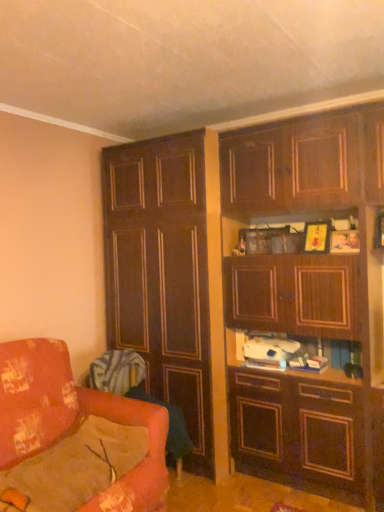
Question: Considering the relative positions of velvet orange swivel chair at lower left, arranged as the 1th swivel chair when viewed from the top, and wooden cabinet at upper right, which ranks as the second cabinetry in left-to-right order, in the image provided, is velvet orange swivel chair at lower left, arranged as the 1th swivel chair when viewed from the top, to the left of wooden cabinet at upper right, which ranks as the second cabinetry in left-to-right order, from the viewer's perspective?

Choices:
 (A) yes
 (B) no

Answer: (A)

Question: From a real-world perspective, does velvet orange swivel chair at lower left, the 2th swivel chair in the bottom-to-top sequence, sit lower than wooden cabinet at upper right, which ranks as the second cabinetry in left-to-right order?

Choices:
 (A) yes
 (B) no

Answer: (A)

Question: From the image's perspective, does velvet orange swivel chair at lower left, the 2th swivel chair in the bottom-to-top sequence, appear higher than wooden cabinet at upper right, arranged as the 1th cabinetry when viewed from the right?

Choices:
 (A) yes
 (B) no

Answer: (B)

Question: Is velvet orange swivel chair at lower left, arranged as the 1th swivel chair when viewed from the top, positioned far away from wooden cabinet at upper right, arranged as the 1th cabinetry when viewed from the right?

Choices:
 (A) no
 (B) yes

Answer: (A)

Question: Is velvet orange swivel chair at lower left, the 2th swivel chair in the bottom-to-top sequence, surrounding wooden cabinet at upper right, which ranks as the second cabinetry in left-to-right order?

Choices:
 (A) yes
 (B) no

Answer: (B)

Question: Is point (56, 501) closer or farther from the camera than point (190, 443)?

Choices:
 (A) closer
 (B) farther

Answer: (A)

Question: From the image's perspective, is floral fabric couch at lower left located above or below velvet orange swivel chair at lower left, the second swivel chair from the top?

Choices:
 (A) above
 (B) below

Answer: (A)

Question: Considering the positions of floral fabric couch at lower left and velvet orange swivel chair at lower left, acting as the 1th swivel chair starting from the bottom, in the image, is floral fabric couch at lower left wider or thinner than velvet orange swivel chair at lower left, acting as the 1th swivel chair starting from the bottom,?

Choices:
 (A) wide
 (B) thin

Answer: (A)

Question: Is floral fabric couch at lower left in front of or behind velvet orange swivel chair at lower left, the second swivel chair from the top, in the image?

Choices:
 (A) front
 (B) behind

Answer: (A)

Question: From a real-world perspective, is velvet orange swivel chair at lower left, acting as the 1th swivel chair starting from the bottom, positioned above or below wooden cabinet at upper right, arranged as the 1th cabinetry when viewed from the right?

Choices:
 (A) above
 (B) below

Answer: (B)

Question: Would you say velvet orange swivel chair at lower left, acting as the 1th swivel chair starting from the bottom, is to the left or to the right of wooden cabinet at upper right, which ranks as the second cabinetry in left-to-right order, in the picture?

Choices:
 (A) left
 (B) right

Answer: (A)

Question: From the image's perspective, is velvet orange swivel chair at lower left, the second swivel chair from the top, positioned above or below wooden cabinet at upper right, which ranks as the second cabinetry in left-to-right order?

Choices:
 (A) above
 (B) below

Answer: (B)

Question: In terms of size, does velvet orange swivel chair at lower left, acting as the 1th swivel chair starting from the bottom, appear bigger or smaller than wooden cabinet at upper right, arranged as the 1th cabinetry when viewed from the right?

Choices:
 (A) small
 (B) big

Answer: (A)

Question: Is velvet orange swivel chair at lower left, arranged as the 1th swivel chair when viewed from the top, to the left or to the right of floral fabric couch at lower left in the image?

Choices:
 (A) left
 (B) right

Answer: (B)

Question: From their relative heights in the image, would you say velvet orange swivel chair at lower left, arranged as the 1th swivel chair when viewed from the top, is taller or shorter than floral fabric couch at lower left?

Choices:
 (A) short
 (B) tall

Answer: (A)